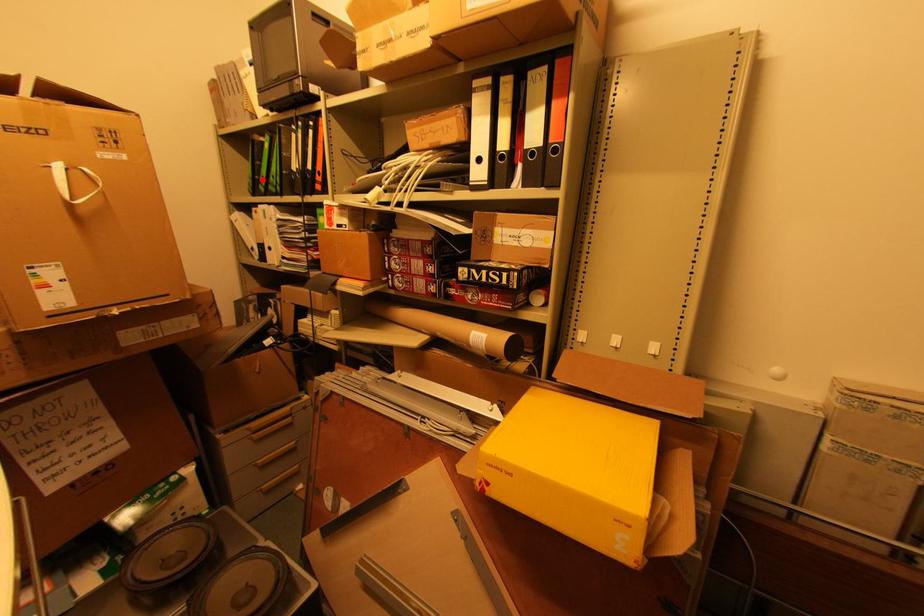
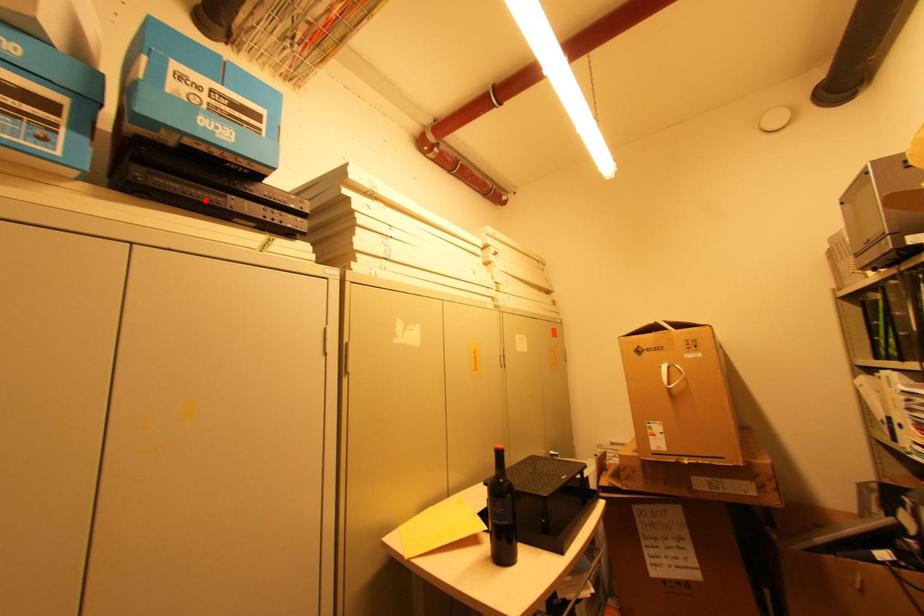
I am providing you with two images of the same scene from different viewpoints. A red point is marked on the first image and another point is marked on the second image. Is the marked point in image1 the same physical position as the marked point in image2?

No